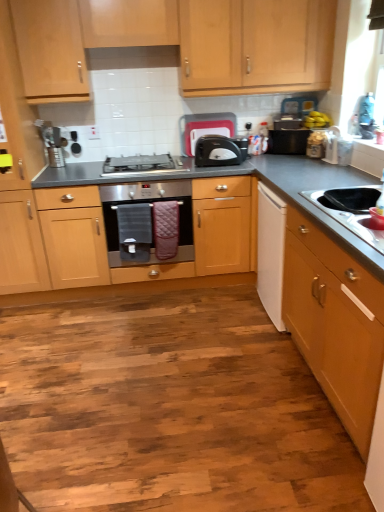
Where is `free spot to the right of brushed metal toaster at center, placed as the 1th appliance when sorted from left to right`? free spot to the right of brushed metal toaster at center, placed as the 1th appliance when sorted from left to right is located at coordinates (84, 163).